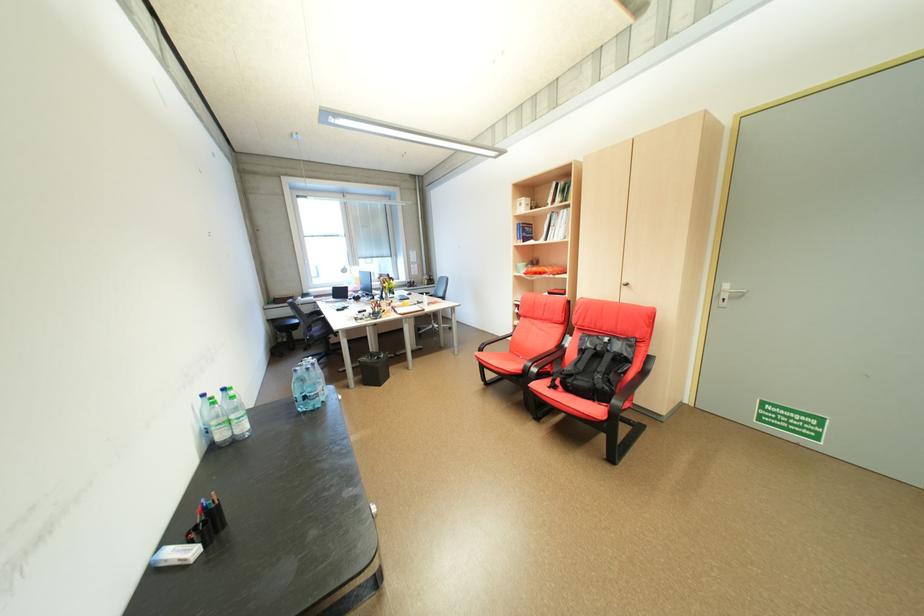
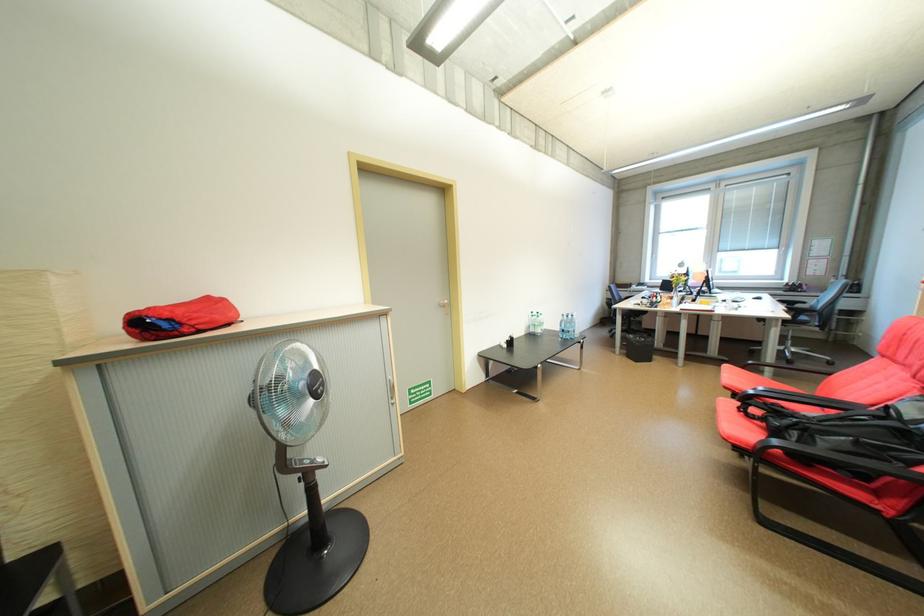
Where in the second image is the point corresponding to (232,437) from the first image?

(541, 331)